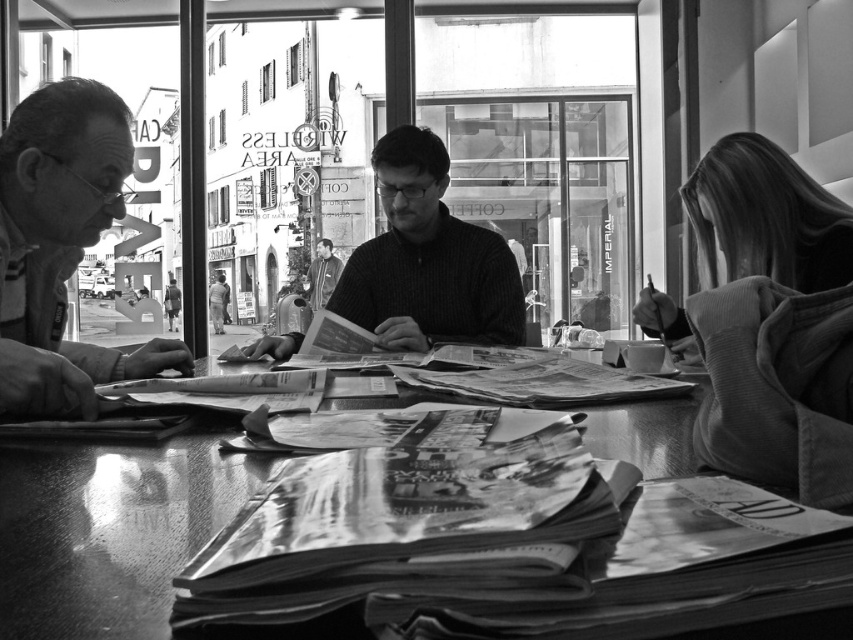
Question: Among these objects, which one is farthest from the camera?

Choices:
 (A) knitted sweater at center
 (B) smooth gray jacket at center

Answer: (B)

Question: Among these objects, which one is farthest from the camera?

Choices:
 (A) knitted sweater at center
 (B) smooth gray jacket at center
 (C) soft corduroy jacket at right
 (D) smooth wooden table at center

Answer: (B)

Question: Does smooth wooden table at center appear over matte black glasses at left?

Choices:
 (A) no
 (B) yes

Answer: (A)

Question: Observing the image, what is the correct spatial positioning of smooth wooden table at center in reference to soft corduroy jacket at right?

Choices:
 (A) below
 (B) above

Answer: (A)

Question: Does soft corduroy jacket at right appear on the left side of smooth gray jacket at center?

Choices:
 (A) no
 (B) yes

Answer: (A)

Question: Which of the following is the farthest from the observer?

Choices:
 (A) (288, 340)
 (B) (784, 227)

Answer: (A)